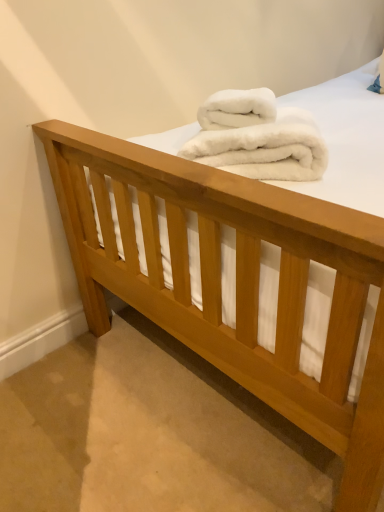
Question: Is white fluffy towel at center, acting as the first towel starting from the top, at the right side of white fluffy towels at center, which appears as the first towel when ordered from the bottom?

Choices:
 (A) yes
 (B) no

Answer: (B)

Question: From a real-world perspective, is white fluffy towel at center, acting as the first towel starting from the top, located beneath white fluffy towels at center, placed as the 2th towel when sorted from top to bottom?

Choices:
 (A) no
 (B) yes

Answer: (A)

Question: Is white fluffy towel at center, acting as the first towel starting from the top, aimed at white fluffy towels at center, placed as the 2th towel when sorted from top to bottom?

Choices:
 (A) yes
 (B) no

Answer: (A)

Question: From a real-world perspective, is white fluffy towel at center, which is the second towel in bottom-to-top order, physically above white fluffy towels at center, which appears as the first towel when ordered from the bottom?

Choices:
 (A) no
 (B) yes

Answer: (B)

Question: Is white fluffy towels at center, which appears as the first towel when ordered from the bottom, completely or partially inside white fluffy towel at center, acting as the first towel starting from the top?

Choices:
 (A) no
 (B) yes

Answer: (A)

Question: Is white fluffy towel at center, acting as the first towel starting from the top, behind white fluffy towels at center, placed as the 2th towel when sorted from top to bottom?

Choices:
 (A) yes
 (B) no

Answer: (A)

Question: Is white fluffy towel at center, which is the second towel in bottom-to-top order, inside white fluffy towels at center, which appears as the first towel when ordered from the bottom?

Choices:
 (A) no
 (B) yes

Answer: (B)

Question: Is white fluffy towels at center, placed as the 2th towel when sorted from top to bottom, next to white fluffy towel at center, acting as the first towel starting from the top?

Choices:
 (A) yes
 (B) no

Answer: (A)

Question: From the image's perspective, is white fluffy towels at center, placed as the 2th towel when sorted from top to bottom, beneath white fluffy towel at center, acting as the first towel starting from the top?

Choices:
 (A) no
 (B) yes

Answer: (B)

Question: From the image's perspective, would you say white fluffy towels at center, placed as the 2th towel when sorted from top to bottom, is positioned over white fluffy towel at center, acting as the first towel starting from the top?

Choices:
 (A) yes
 (B) no

Answer: (B)

Question: Considering the relative sizes of white fluffy towels at center, placed as the 2th towel when sorted from top to bottom, and white fluffy towel at center, acting as the first towel starting from the top, in the image provided, is white fluffy towels at center, placed as the 2th towel when sorted from top to bottom, shorter than white fluffy towel at center, acting as the first towel starting from the top,?

Choices:
 (A) yes
 (B) no

Answer: (B)

Question: Is white fluffy towels at center, placed as the 2th towel when sorted from top to bottom, facing away from white fluffy towel at center, which is the second towel in bottom-to-top order?

Choices:
 (A) yes
 (B) no

Answer: (B)

Question: In terms of size, does white fluffy towel at center, which is the second towel in bottom-to-top order, appear bigger or smaller than white fluffy towels at center, placed as the 2th towel when sorted from top to bottom?

Choices:
 (A) big
 (B) small

Answer: (B)